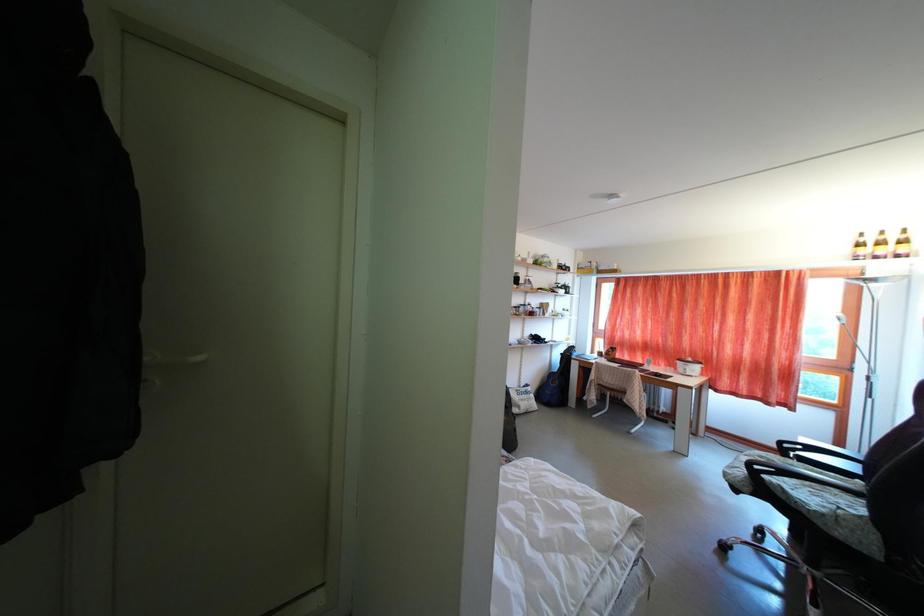
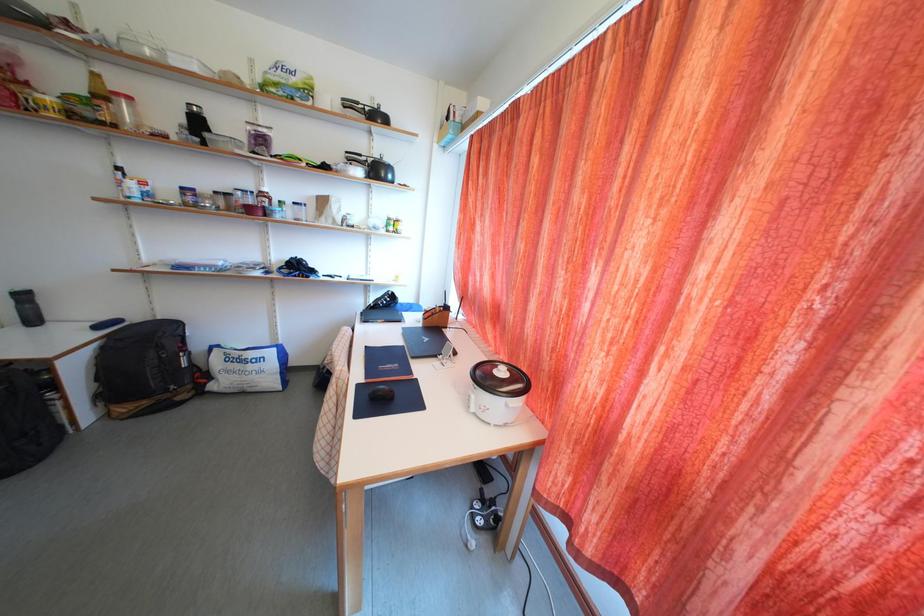
Which direction would the cameraman need to move to produce the second image?

The cameraman moved toward right, forward.